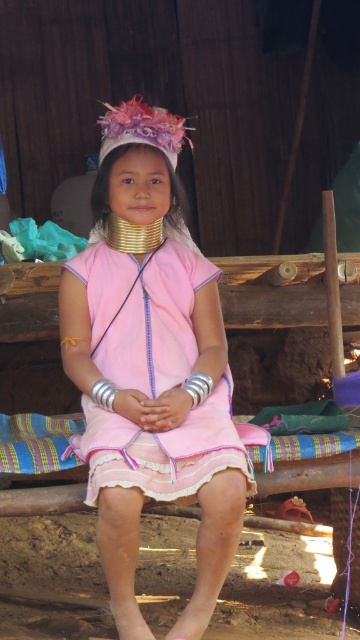
You are a fashion designer observing two dresses in the image. The pink matte dress at center and the pink satin dress at center. Which one has a larger size?

The pink matte dress at center is bigger than the pink satin dress at center.

Based on the scene description, where is the pink satin dress at center located in terms of its 2D coordinates?

The pink satin dress at center is located at the 2D coordinates point (142, 314).

What is the exact location of the fuzzy pink headdress at center in the image?

The fuzzy pink headdress at center is located at point coordinates of (141, 131).